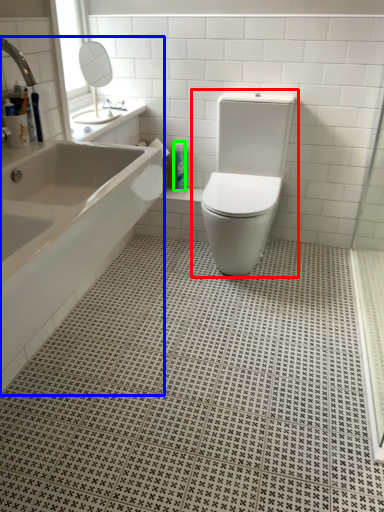
Question: Considering the real-world distances, which object is closest to toilet (highlighted by a red box)? bathtub (highlighted by a blue box) or toiletry (highlighted by a green box).

Choices:
 (A) bathtub
 (B) toiletry

Answer: (B)